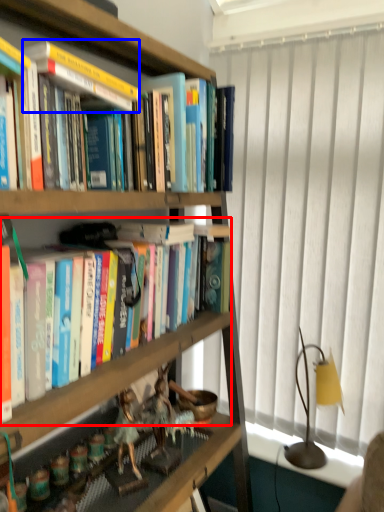
Question: Which point is further to the camera, book (highlighted by a red box) or paperback book (highlighted by a blue box)?

Choices:
 (A) book
 (B) paperback book

Answer: (B)